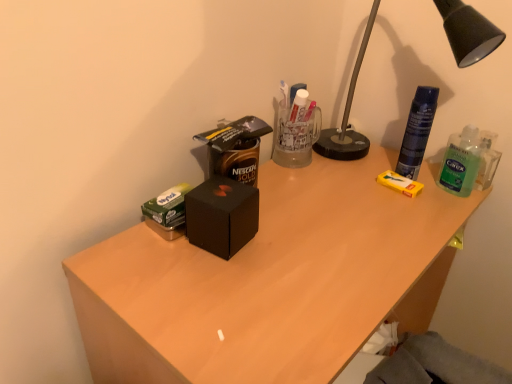
Locate an element on the screen. vacant point to the left of green translucent hand sanitizer at right is located at coordinates (386, 188).